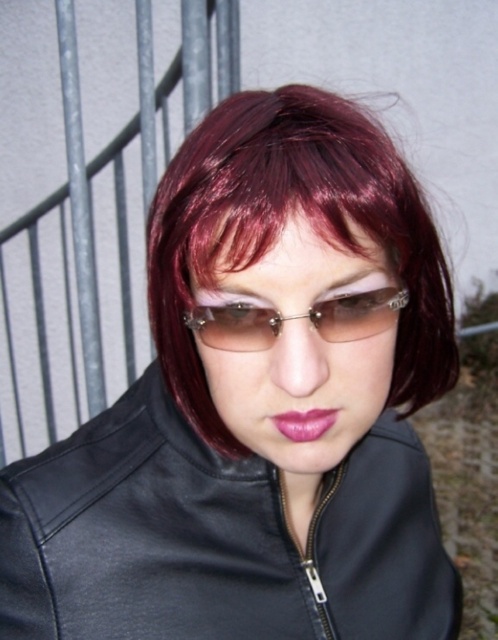
Between point (386, 436) and point (248, 248), which one is positioned behind?

Positioned behind is point (386, 436).

Where is `black leather jacket at center`? The image size is (498, 640). black leather jacket at center is located at coordinates (217, 538).

Where is `black leather jacket at center`? black leather jacket at center is located at coordinates click(217, 538).

Does point (228, 308) come behind point (285, 422)?

No, it is not.

Between clear plastic glasses at center and pink glossy lips at center, which one appears on the left side from the viewer's perspective?

clear plastic glasses at center is more to the left.

This screenshot has height=640, width=498. What do you see at coordinates (296, 317) in the screenshot? I see `clear plastic glasses at center` at bounding box center [296, 317].

Find the location of a particular element. Image resolution: width=498 pixels, height=640 pixels. clear plastic glasses at center is located at coordinates (296, 317).

Who is shorter, black leather jacket at center or pink glossy lips at center?

pink glossy lips at center is shorter.

Is point (169, 406) less distant than point (294, 420)?

No, it is not.

Locate an element on the screen. black leather jacket at center is located at coordinates point(217,538).

Locate an element on the screen. This screenshot has height=640, width=498. black leather jacket at center is located at coordinates (217, 538).